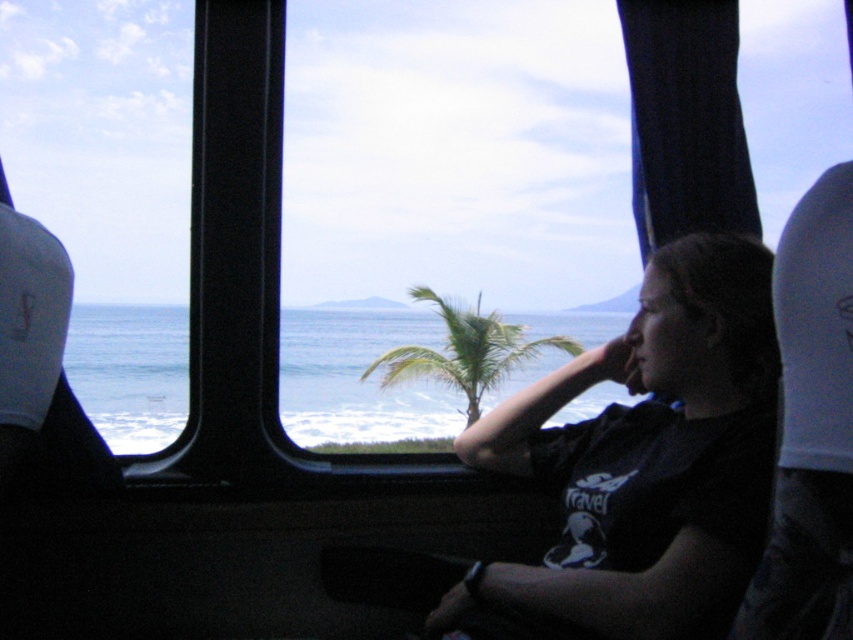
Which is in front, point (48, 12) or point (387, 353)?

Positioned in front is point (48, 12).

Which is more to the right, transparent glass window at left or green leafy palm tree at center?

green leafy palm tree at center

Find the location of `transparent glass window at left`. transparent glass window at left is located at coordinates (109, 193).

You are a GUI agent. You are given a task and a screenshot of the screen. Output one action in this format:
    pyautogui.click(x=<x>, y=<y>)
    Task: Click on the transparent glass window at left
    
    Given the screenshot: What is the action you would take?
    (x=109, y=193)

Is black matte shirt at center wider than green leafy palm tree at center?

Incorrect, black matte shirt at center's width does not surpass green leafy palm tree at center's.

Is point (747, 428) more distant than point (381, 385)?

No, (747, 428) is in front of (381, 385).

Find the location of a particular element. black matte shirt at center is located at coordinates (648, 458).

Is point (445, 429) positioned after point (483, 346)?

Yes, point (445, 429) is farther from viewer.

Can you confirm if transparent glass window at center is taller than green leafy palm tree at center?

Indeed, transparent glass window at center has a greater height compared to green leafy palm tree at center.

Does point (561, 326) come farther from viewer compared to point (467, 406)?

No.

The width and height of the screenshot is (853, 640). Identify the location of transparent glass window at center. (444, 195).